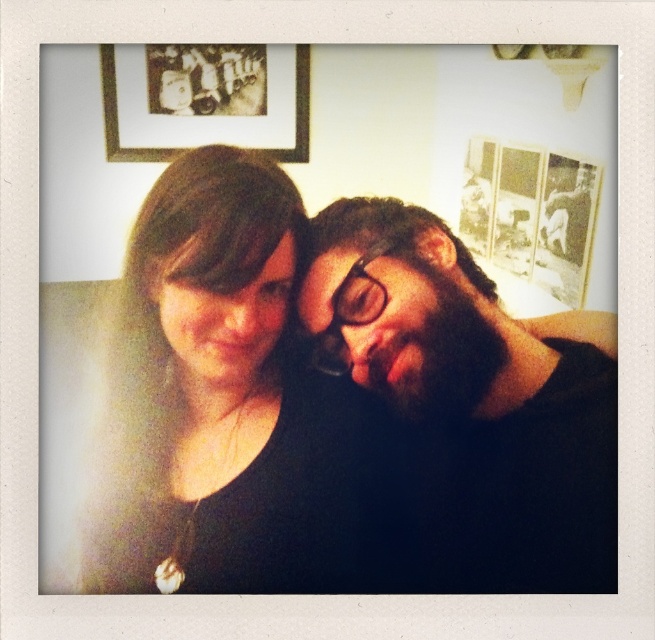
You are designing a layout for a magazine spread and need to ensure that the black matte hair at center and the matte black frame at upper left are proportionally sized. Based on the image, which object is wider?

The black matte hair at center is wider than the matte black frame at upper left.

You are an interior designer assessing the spacing between the dark brown hair at center and the matte black frame at upper left. Based on their sizes, which object would you estimate occupies more horizontal space in the image?

The dark brown hair at center has a larger width than the matte black frame at upper left, so it occupies more horizontal space in the image.